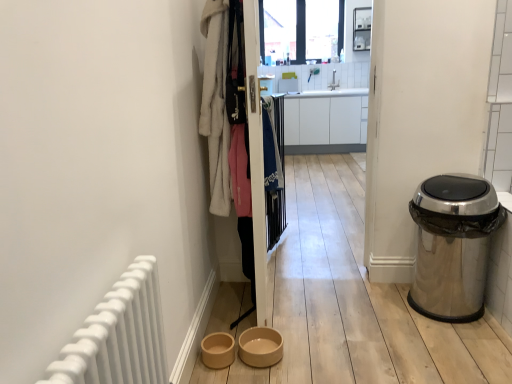
Question: From a real-world perspective, is blue fabric at center, which is the 1th clothing from back to front, above or below polished stainless steel trash can at right?

Choices:
 (A) below
 (B) above

Answer: (B)

Question: From the image's perspective, is blue fabric at center, which is the 2th clothing from front to back, above or below polished stainless steel trash can at right?

Choices:
 (A) above
 (B) below

Answer: (A)

Question: Which is farther from the white glossy sink at upper center?

Choices:
 (A) clear glass shelves at upper center
 (B) wooden screen door at center
 (C) brown matte bowl at lower center, arranged as the second toilet bowl when viewed from the right
 (D) white matte radiator at left
 (E) beige ceramic bowl at lower center, which appears as the first toilet bowl when viewed from the right

Answer: (D)

Question: Estimate the real-world distances between objects in this image. Which object is farther from the white glossy cabinet at center?

Choices:
 (A) white matte radiator at left
 (B) white fluffy bathrobe at upper left, which is counted as the second clothing, starting from the back
 (C) transparent glass window at upper center
 (D) brown matte bowl at lower center, the first toilet bowl in the left-to-right sequence
 (E) blue fabric at center, marked as the second clothing in a left-to-right arrangement

Answer: (A)